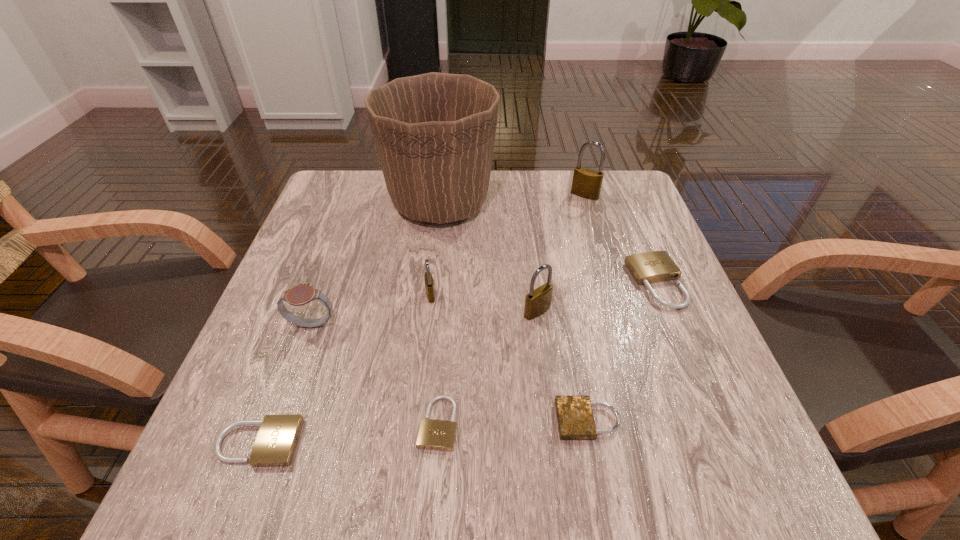
In order to click on free space between the farthest brass padlock and the fifth shortest padlock in this screenshot , I will do `click(508, 245)`.

Locate which object is the second closest to the gray watch. Please provide its 2D coordinates. Your answer should be formatted as a tuple, i.e. [(x, y)], where the tuple contains the x and y coordinates of a point satisfying the conditions above.

[(276, 441)]

Identify which object is the eighth nearest to the leftmost brass padlock. Please provide its 2D coordinates. Your answer should be formatted as a tuple, i.e. [(x, y)], where the tuple contains the x and y coordinates of a point satisfying the conditions above.

[(586, 183)]

Image resolution: width=960 pixels, height=540 pixels. I want to click on padlock that stands as the fourth closest to the shortest object, so click(x=429, y=283).

The height and width of the screenshot is (540, 960). I want to click on the closest padlock to the biggest beige padlock, so pos(538,301).

Point out which brass padlock is positioned as the third nearest to the smallest beige padlock. Please provide its 2D coordinates. Your answer should be formatted as a tuple, i.e. [(x, y)], where the tuple contains the x and y coordinates of a point satisfying the conditions above.

[(586, 183)]

Locate which brass padlock is the closest to the leftmost padlock. Please provide its 2D coordinates. Your answer should be formatted as a tuple, i.e. [(x, y)], where the tuple contains the x and y coordinates of a point satisfying the conditions above.

[(429, 283)]

This screenshot has width=960, height=540. In order to click on the closest beige padlock to the tallest object in this screenshot , I will do `click(657, 266)`.

Identify which beige padlock is located as the nearest to the sixth padlock from left to right. Please provide its 2D coordinates. Your answer should be formatted as a tuple, i.e. [(x, y)], where the tuple contains the x and y coordinates of a point satisfying the conditions above.

[(657, 266)]

Locate an element on the screen. This screenshot has width=960, height=540. blank area in the image that satisfies the following two spatial constraints: 1. on the back side of the farthest brass padlock; 2. on the left side of the second smallest brass padlock is located at coordinates (522, 195).